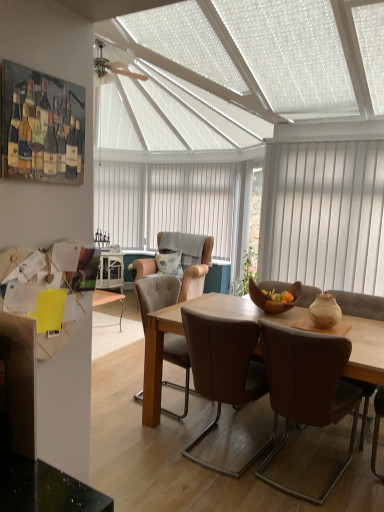
The height and width of the screenshot is (512, 384). Identify the location of empty space that is ontop of white wood blinds at right (from a real-world perspective). (338, 131).